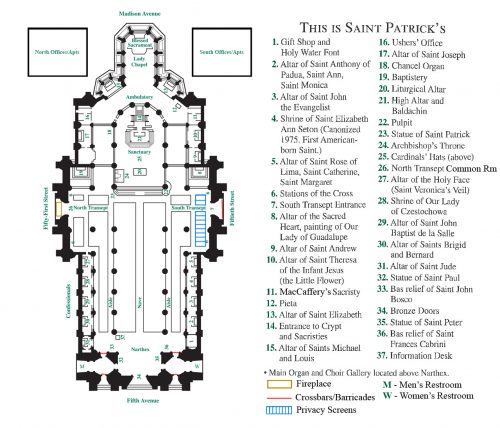
Find the location of `altar`. altar is located at coordinates (154, 357).